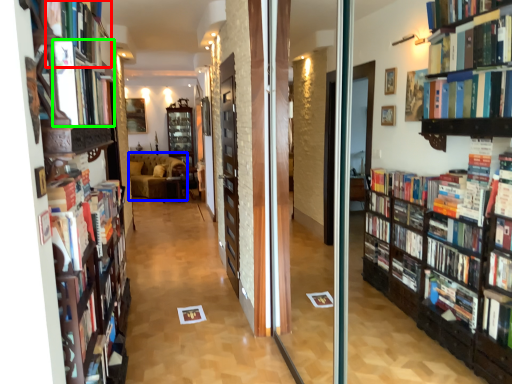
Question: Which is farther away from book (highlighted by a red box)? furniture (highlighted by a blue box) or book (highlighted by a green box)?

Choices:
 (A) furniture
 (B) book

Answer: (A)